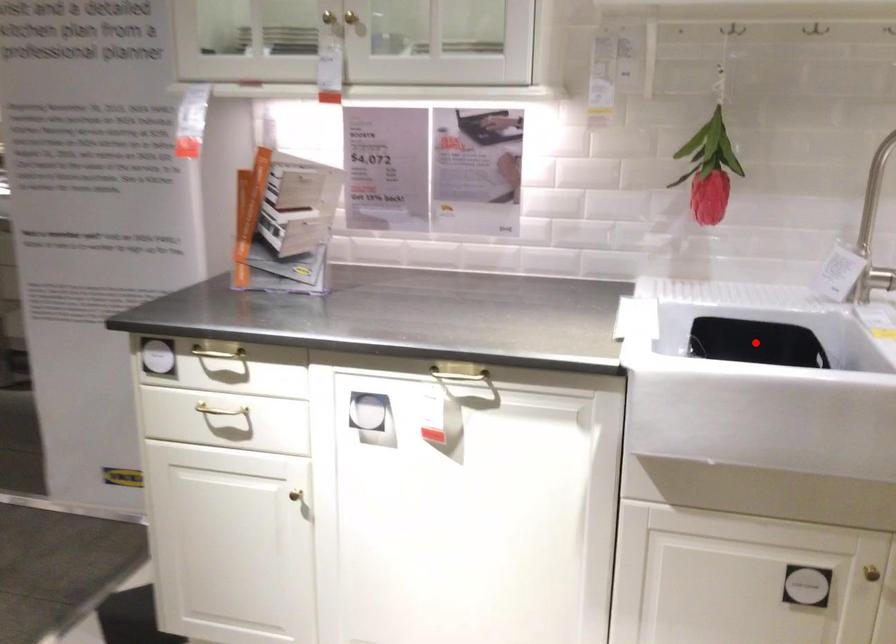
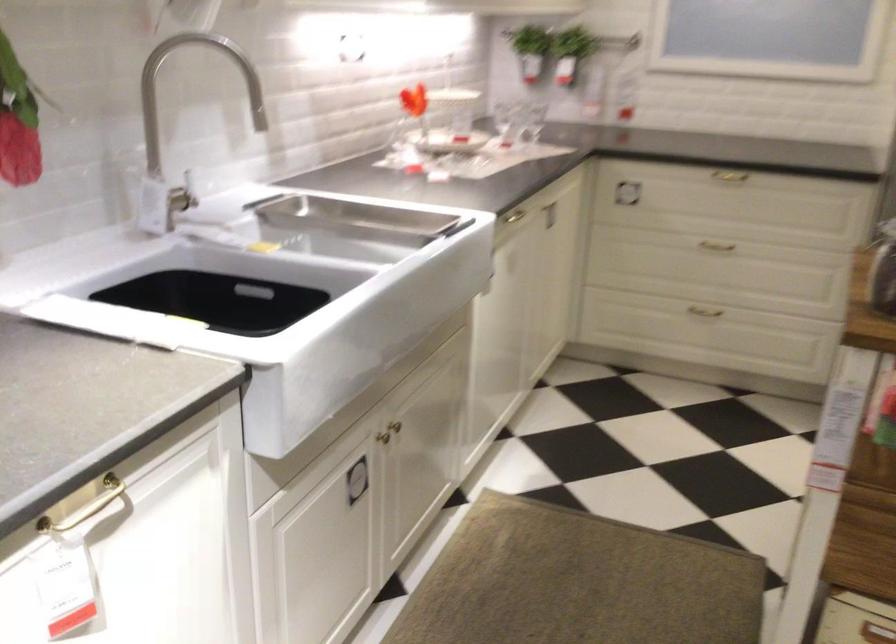
Question: I am providing you with two images of the same scene from different viewpoints. Image1 has a red point marked. In image2, the corresponding 3D location appears at what relative position? Reply with the corresponding letter.

Choices:
 (A) Closer
 (B) Farther

Answer: (A)